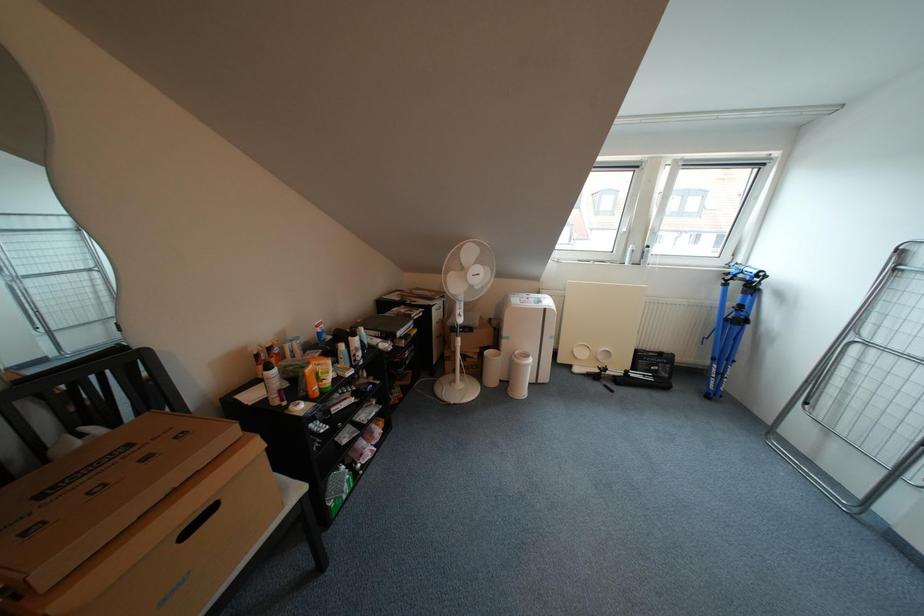
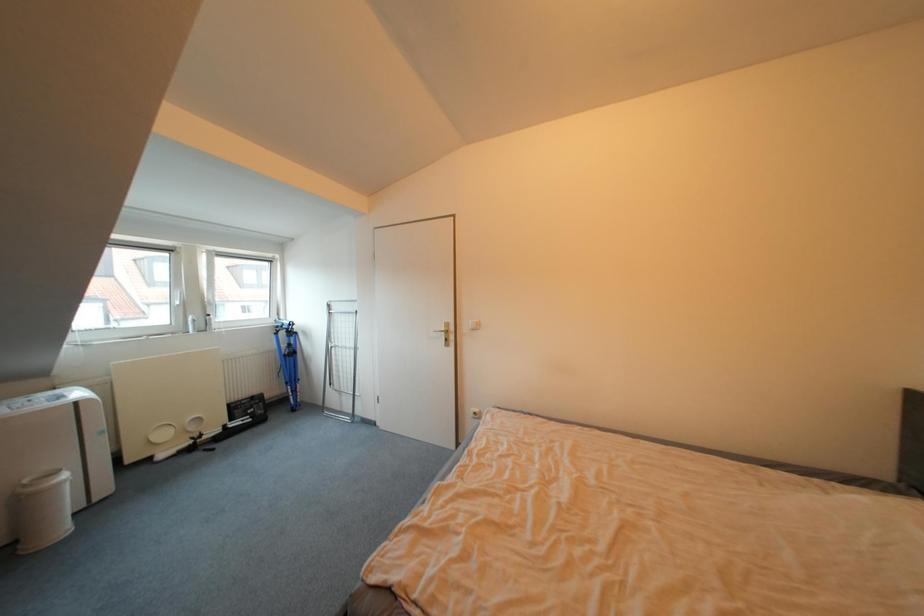
Question: The camera is either moving clockwise (left) or counter-clockwise (right) around the object. The first image is from the beginning of the video and the second image is from the end. Is the camera moving left or right when shooting the video?

Choices:
 (A) Left
 (B) Right

Answer: (A)